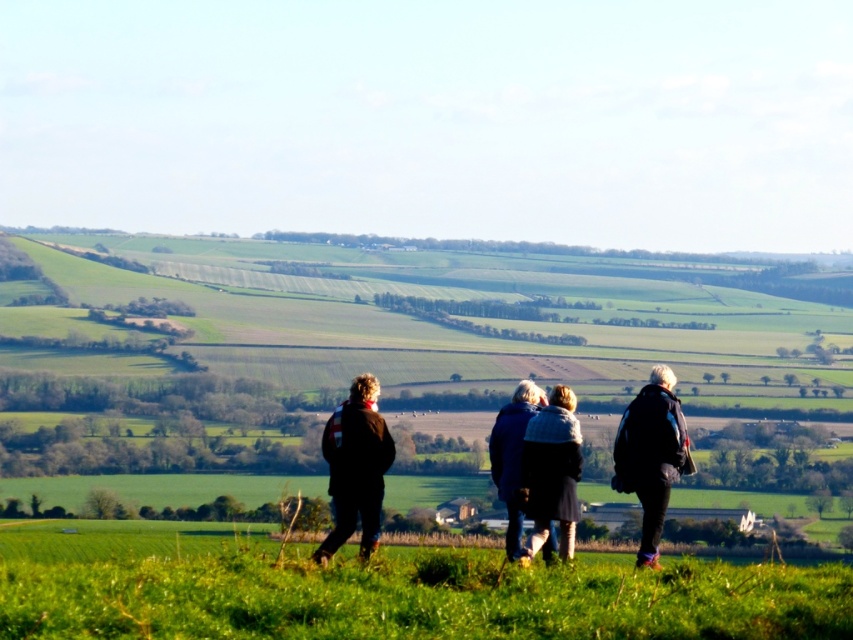
Between dark blue jacket at center and knitted sweater at center, which one has less height?

Standing shorter between the two is knitted sweater at center.

Does point (657, 365) come behind point (534, 536)?

Yes, point (657, 365) is behind point (534, 536).

The width and height of the screenshot is (853, 640). Find the location of `dark blue jacket at center`. dark blue jacket at center is located at coordinates (650, 454).

How far apart are dark brown jacket at center and dark blue jacket at center?

dark brown jacket at center and dark blue jacket at center are 8.10 feet apart from each other.

Who is higher up, dark brown jacket at center or dark blue jacket at center?

dark blue jacket at center is higher up.

This screenshot has height=640, width=853. What are the coordinates of `dark brown jacket at center` in the screenshot? It's located at (355, 467).

Between point (650, 420) and point (520, 396), which one is positioned in front?

Point (650, 420)

I want to click on dark blue jacket at center, so click(x=650, y=454).

This screenshot has width=853, height=640. What do you see at coordinates (650, 454) in the screenshot?
I see `dark blue jacket at center` at bounding box center [650, 454].

This screenshot has width=853, height=640. Find the location of `dark blue jacket at center`. dark blue jacket at center is located at coordinates (650, 454).